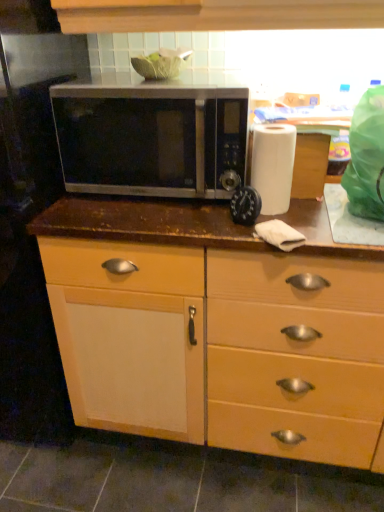
The height and width of the screenshot is (512, 384). I want to click on vacant space to the right of black plastic timer at center, so click(318, 219).